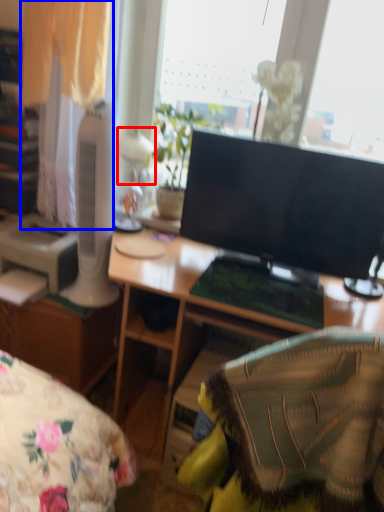
Question: Which point is further to the camera, table lamp (highlighted by a red box) or curtain (highlighted by a blue box)?

Choices:
 (A) table lamp
 (B) curtain

Answer: (A)